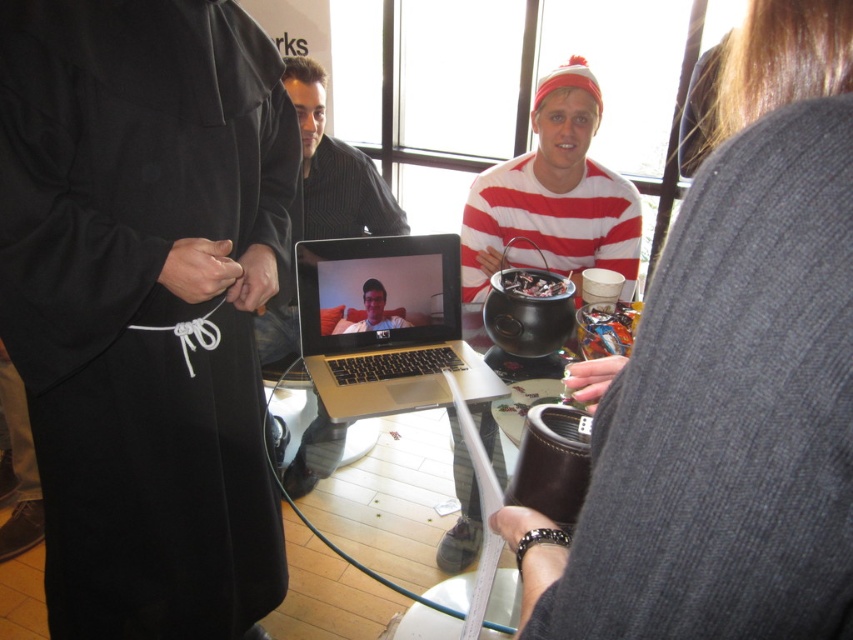
You are a photographer trying to capture a clear shot of the metallic silver laptop at center during the video call. However, the black matte robe at left is blocking your view. Can you move the robe to get a better angle?

The black matte robe at left is closer to the viewer than the metallic silver laptop at center, so moving the robe would allow you to see the laptop without obstruction.

You are standing in front of the laptop on the glass table during the video call. Where is the black matte robe at left located relative to your position?

The black matte robe at left is located at point 0.475 on the x axis and 0.171 on the y axis relative to the image frame.